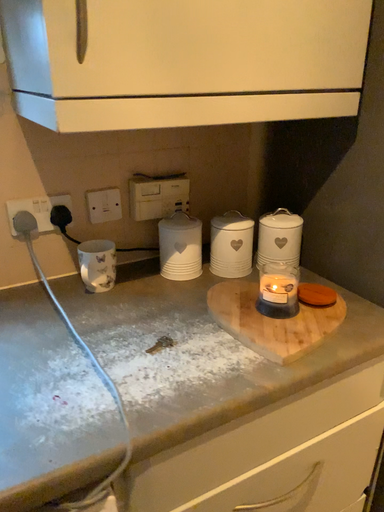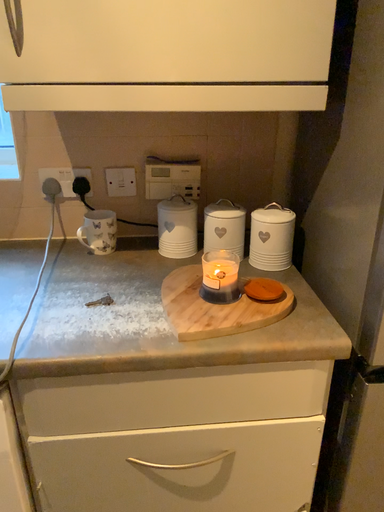
Question: Which way did the camera rotate in the video?

Choices:
 (A) rotated right
 (B) rotated left

Answer: (B)